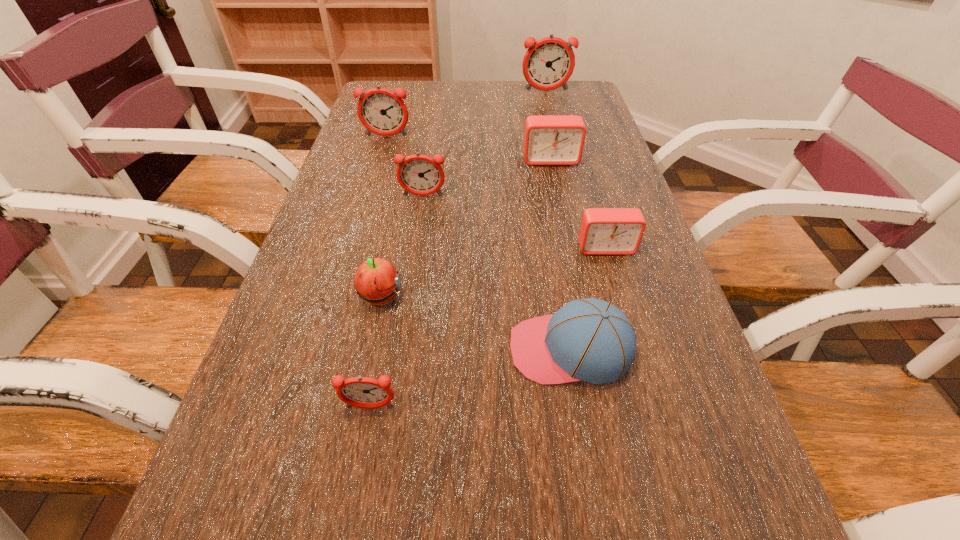
The width and height of the screenshot is (960, 540). Find the location of `alarm clock that is the closest one to the bigger red alarm clock`. alarm clock that is the closest one to the bigger red alarm clock is located at coordinates (421, 175).

This screenshot has width=960, height=540. In order to click on reddish-pink alarm clock that is the third closest one to the bigger red alarm clock in this screenshot , I will do `click(548, 64)`.

Locate an element on the screen. This screenshot has width=960, height=540. the third closest reddish-pink alarm clock to the nearest alarm clock is located at coordinates (548, 64).

Locate an element on the screen. The height and width of the screenshot is (540, 960). the closest red alarm clock relative to the fourth farthest object is located at coordinates (548, 139).

Where is `red alarm clock identified as the second closest to the second farthest object`? red alarm clock identified as the second closest to the second farthest object is located at coordinates (603, 231).

Where is `free space that satisfies the following two spatial constraints: 1. on the front-facing side of the bigger red alarm clock; 2. on the front-facing side of the baseball cap`? The height and width of the screenshot is (540, 960). free space that satisfies the following two spatial constraints: 1. on the front-facing side of the bigger red alarm clock; 2. on the front-facing side of the baseball cap is located at coordinates (590, 349).

This screenshot has height=540, width=960. Find the location of `free point that satisfies the following two spatial constraints: 1. on the front-facing side of the smaller red alarm clock; 2. on the front-facing side of the baseball cap`. free point that satisfies the following two spatial constraints: 1. on the front-facing side of the smaller red alarm clock; 2. on the front-facing side of the baseball cap is located at coordinates (636, 349).

Find the location of a particular element. vacant space that satisfies the following two spatial constraints: 1. on the front-facing side of the baseball cap; 2. on the front-facing side of the nearest alarm clock is located at coordinates (580, 408).